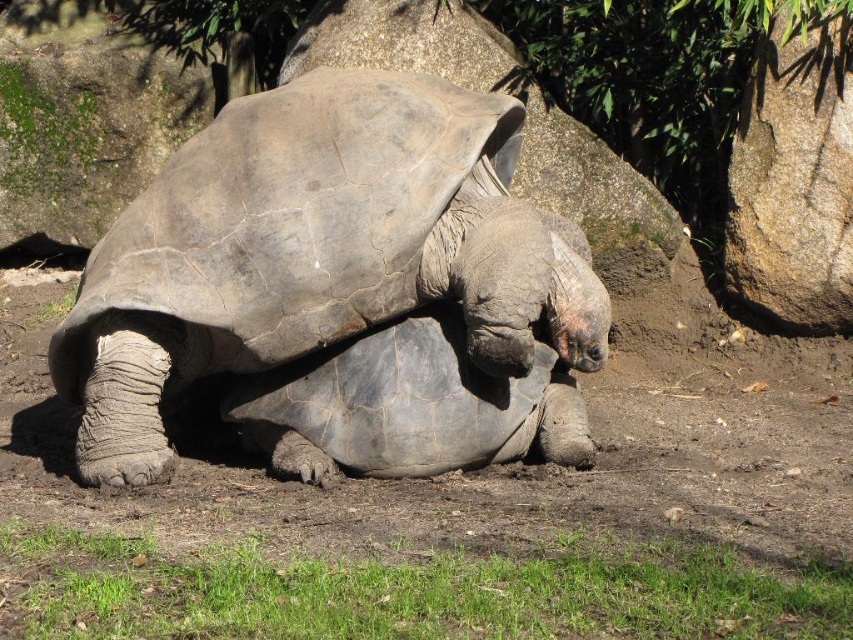
Question: Can you confirm if gray textured tortoise at center is positioned above gray rough stone at upper center?

Choices:
 (A) no
 (B) yes

Answer: (A)

Question: Does brown rough rock at right appear on the left side of gray rough stone at upper center?

Choices:
 (A) yes
 (B) no

Answer: (B)

Question: Which of the following is the farthest from the observer?

Choices:
 (A) (466, 611)
 (B) (848, 148)

Answer: (B)

Question: Which point is closer to the camera taking this photo?

Choices:
 (A) (216, 120)
 (B) (795, 256)
 (C) (6, 544)

Answer: (C)

Question: Does gray textured tortoise at center come behind green grass at lower center?

Choices:
 (A) yes
 (B) no

Answer: (A)

Question: Which of the following is the farthest from the observer?

Choices:
 (A) gray textured tortoise at center
 (B) brown rough rock at right
 (C) gray rough stone at upper center
 (D) green grass at lower center

Answer: (C)